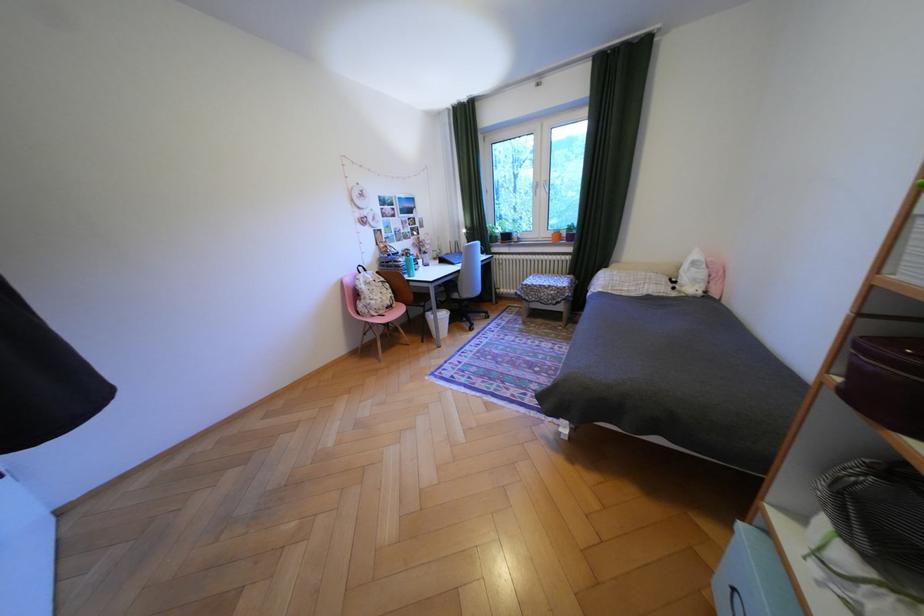
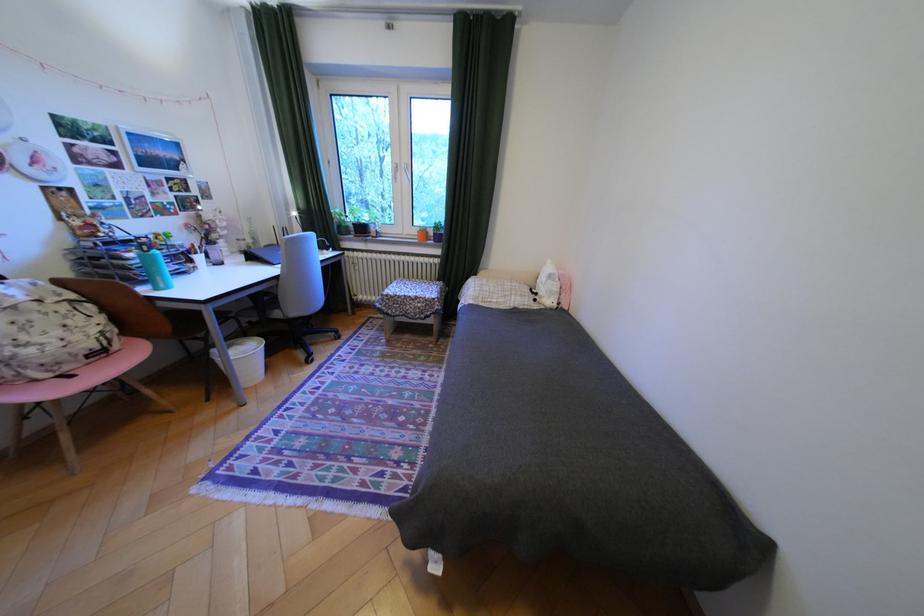
In the second image, find the point that corresponds to (470,272) in the first image.

(288, 278)